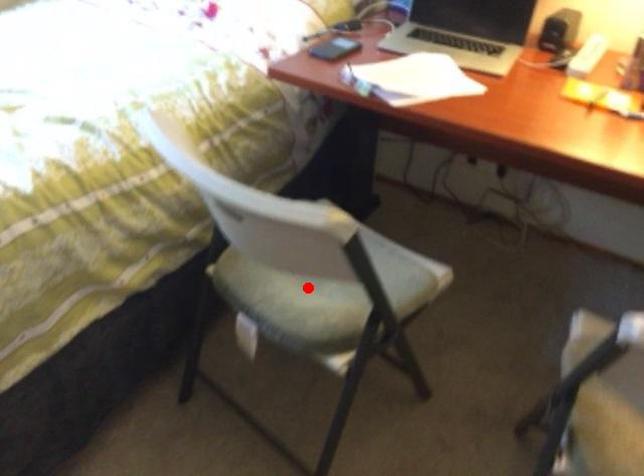
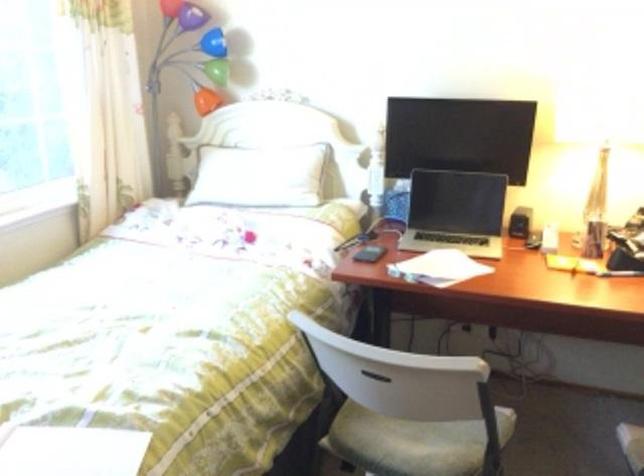
Question: I am providing you with two images of the same scene from different viewpoints. A red point is marked on the first image. Is the red point's position out of view in image 2?

Choices:
 (A) Yes
 (B) No

Answer: (B)